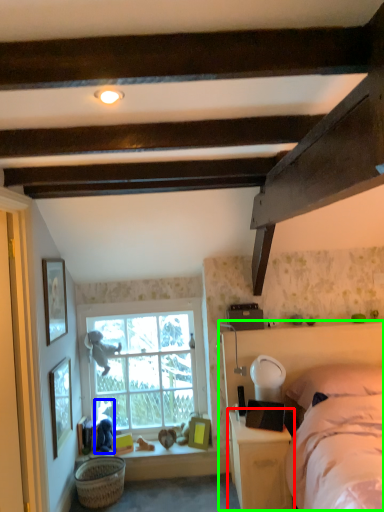
Question: Based on their relative distances, which object is nearer to nightstand (highlighted by a red box)? Choose from person (highlighted by a blue box) and bed frame (highlighted by a green box).

Choices:
 (A) person
 (B) bed frame

Answer: (B)